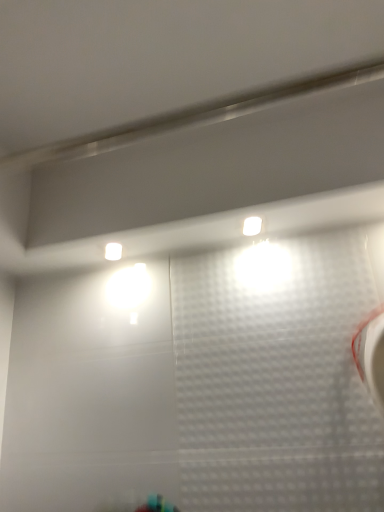
Image resolution: width=384 pixels, height=512 pixels. What are the coordinates of `white glossy lamp at upper left` in the screenshot? It's located at (113, 251).

Image resolution: width=384 pixels, height=512 pixels. What do you see at coordinates (113, 251) in the screenshot?
I see `white glossy lamp at upper left` at bounding box center [113, 251].

In order to face white glossy lamp at upper left, should I rotate leftwards or rightwards?

It's best to rotate left around 10.769 degrees.

This screenshot has height=512, width=384. I want to click on white glossy lamp at upper left, so click(x=113, y=251).